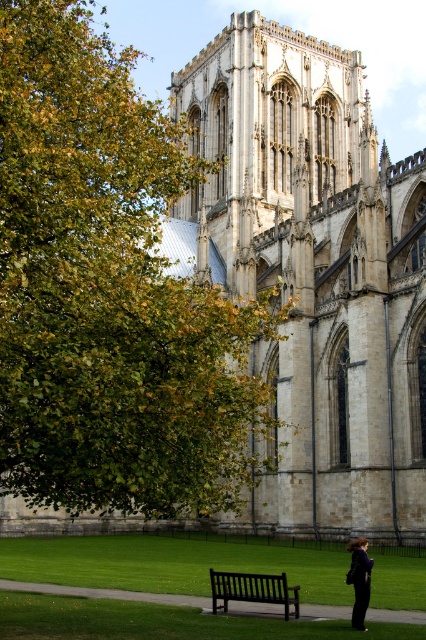
You are a tourist standing on the green lawn in front of the stone gothic cathedral at center. You want to take a photo of the cathedral with the black wooden bench at lower center in the foreground. Will the bench be visible in the photo if you stand at the current position?

The stone gothic cathedral at center is much taller than the black wooden bench at lower center, so the bench will be visible in the foreground of the photo as it is shorter and positioned closer to the camera.

You are standing in the cathedral square and want to sit on the black wooden bench at lower center. Which direction should you walk relative to the stone gothic cathedral at center?

You should walk to the left of the stone gothic cathedral at center to reach the black wooden bench at lower center because the cathedral is positioned to the right of the bench.

You are a photographer planning to capture the stone gothic cathedral at center and the black wooden bench at lower center in a single shot. Based on their sizes, which object should you focus on to ensure both are clearly visible in the photo?

The stone gothic cathedral at center is bigger than the black wooden bench at lower center, so focusing on the cathedral will ensure both are clearly visible in the photo since it occupies more space in the frame.